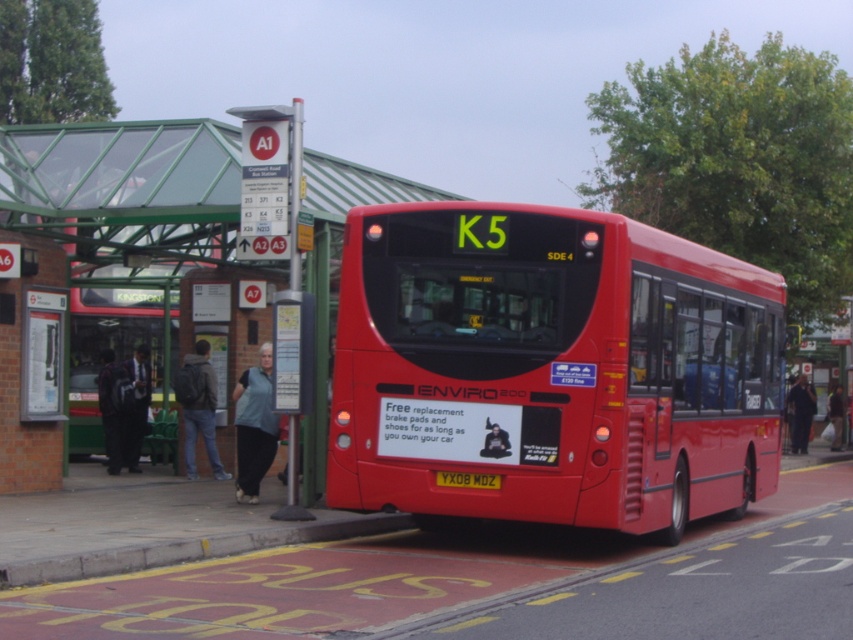
You are a passenger waiting at the bus stop. You notice two people nearby wearing a denim jacket at lower left and a dark suit at left. Which person is taller?

The denim jacket at lower left is taller than the dark suit at left.

Please describe the position of the dark suit at left in terms of coordinates on the image. The image has a coordinate system where the bottom left corner is the origin point. The x and y axes increase to the right and up respectively.

The dark suit at left is located at coordinates approximately 0.639 on the x axis and 0.159 on the y axis.

You are a delivery driver who needs to park your van near the yellow painted concrete curb at lower center. The parking spot must be within 1 meter of the curb. Can you determine if there is enough space to park your van here?

The yellow painted concrete curb at lower center is located at point (192, 548). However, without specific information about the dimensions of the parking area or the distance between the curb and any obstacles, it is impossible to confirm if there is sufficient space to park within 1 meter of the curb. Please check the actual location for accurate measurements.